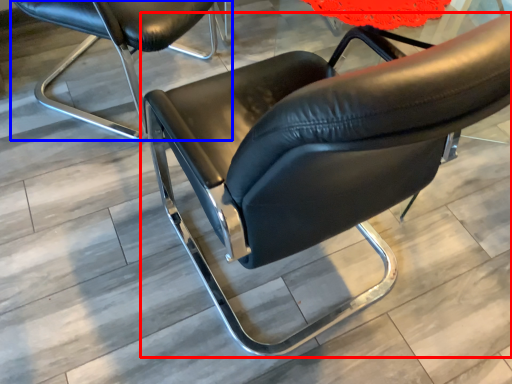
Question: Among these objects, which one is farthest to the camera, chair (highlighted by a red box) or chair (highlighted by a blue box)?

Choices:
 (A) chair
 (B) chair

Answer: (B)